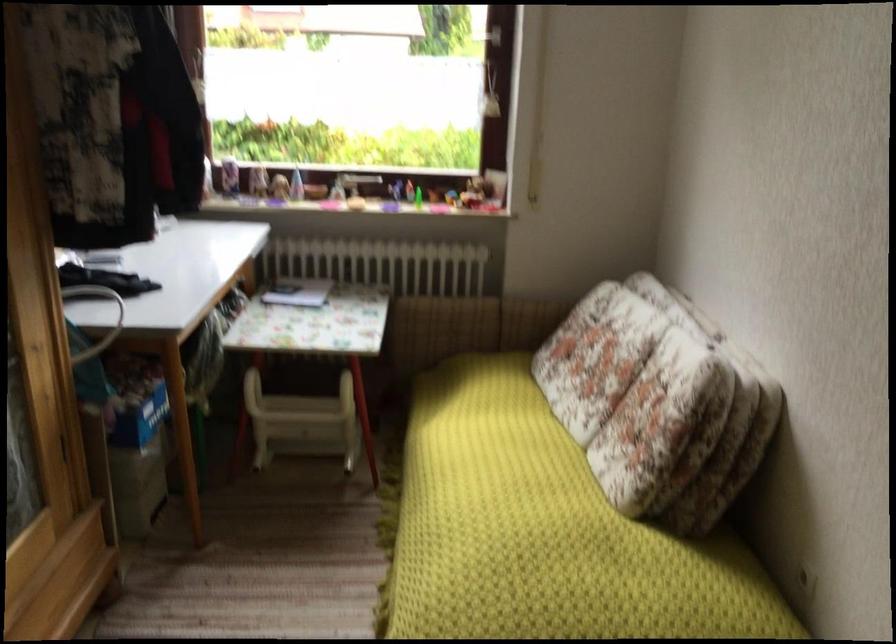
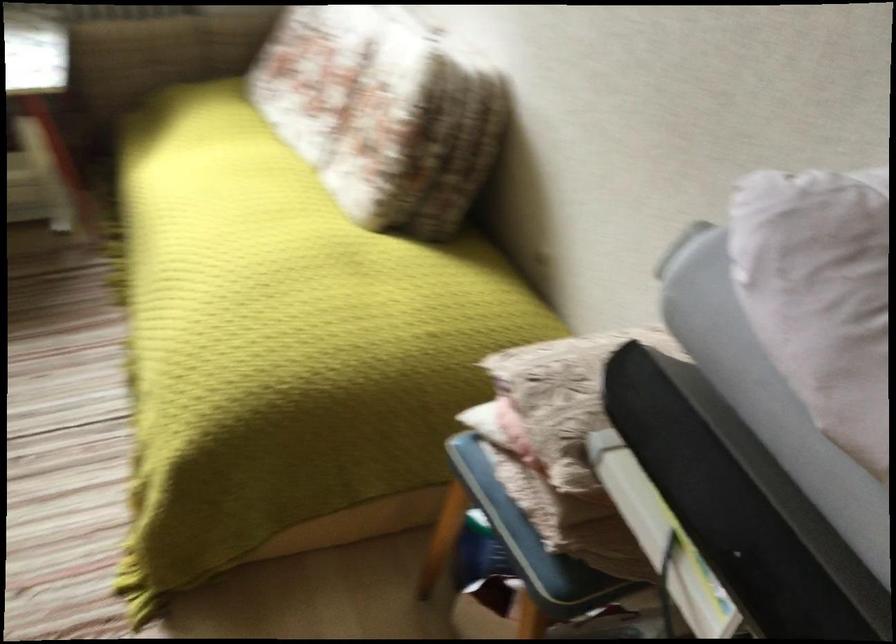
How did the camera likely rotate?

The camera rotated toward right-down.